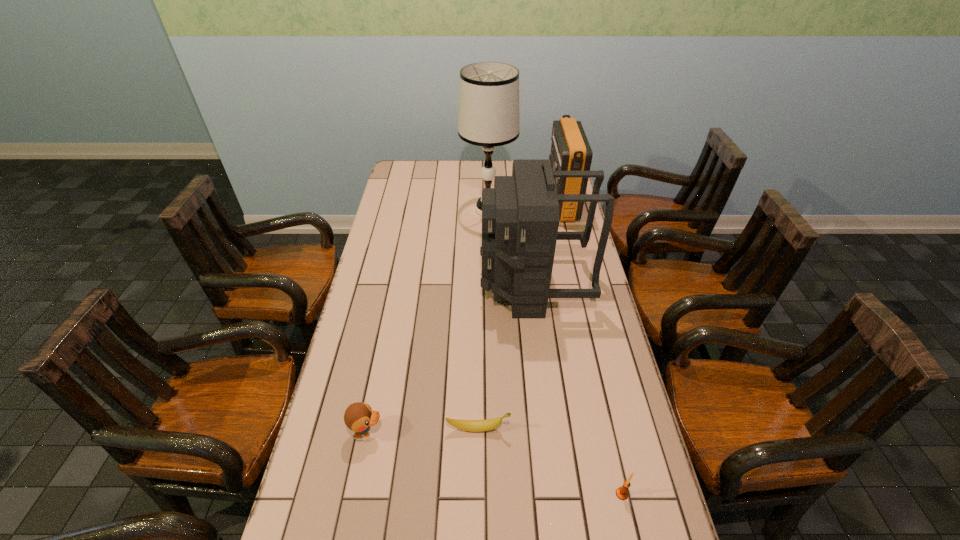
Where is `table lamp`? The image size is (960, 540). table lamp is located at coordinates (488, 116).

This screenshot has height=540, width=960. Identify the location of the second tallest object. (520, 216).

Identify the location of backpack. pos(520,216).

Locate an element on the screen. the fourth shortest object is located at coordinates (570, 151).

Identify the location of candle_holder. This screenshot has width=960, height=540. (621, 492).

I want to click on the leftmost object, so click(359, 417).

This screenshot has width=960, height=540. Identify the location of the shortest object. (467, 425).

Identify the location of vacant space located 0.140m on the left of the table lamp. The height and width of the screenshot is (540, 960). (428, 210).

Find the location of `free space located 0.230m on the front compartment of the fourth nearest object`. free space located 0.230m on the front compartment of the fourth nearest object is located at coordinates (416, 285).

You are a GUI agent. You are given a task and a screenshot of the screen. Output one action in this format:
    pyautogui.click(x=<x>, y=<y>)
    Task: Click on the vacant space located on the front compartment of the fourth nearest object
    
    Given the screenshot: What is the action you would take?
    pyautogui.click(x=373, y=285)